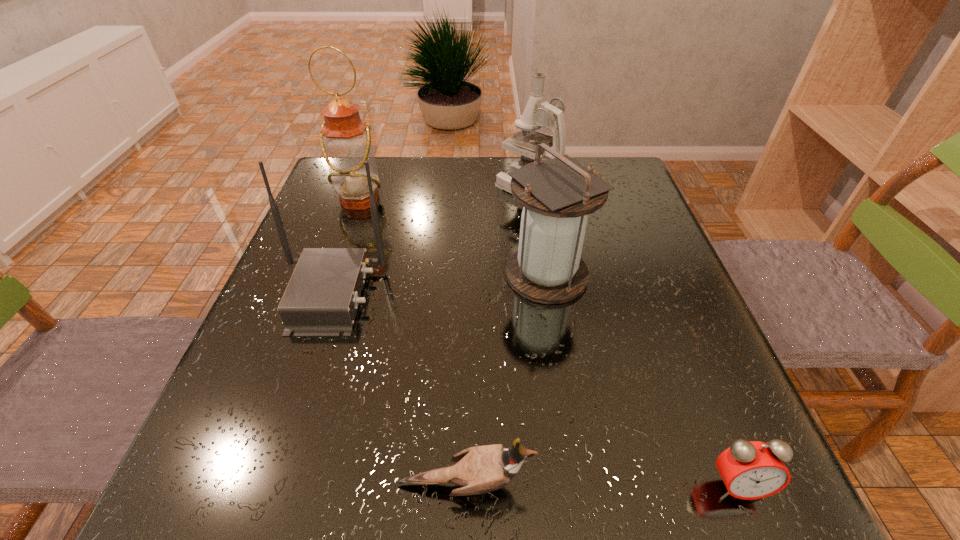
Identify the location of object at the near right corner. The image size is (960, 540). pos(750,470).

The width and height of the screenshot is (960, 540). In order to click on vacant region at the far edge of the desktop in this screenshot , I will do `click(458, 170)`.

You are a GUI agent. You are given a task and a screenshot of the screen. Output one action in this format:
    pyautogui.click(x=<x>, y=<y>)
    Task: Click on the free space at the near edge of the desktop
    The image size is (960, 540).
    Given the screenshot: What is the action you would take?
    pyautogui.click(x=596, y=514)

At what (x,y) coordinates should I click in order to perform the action: click on free spot at the left edge of the desktop. Please return your answer as a coordinate pair (x, y). Looking at the image, I should click on (254, 375).

In the image, there is a desktop. Find the location of `vacant area at the right edge`. vacant area at the right edge is located at coordinates (630, 242).

The image size is (960, 540). Find the location of `vacant region at the far left corner of the desktop`. vacant region at the far left corner of the desktop is located at coordinates (340, 204).

Where is `vacant space at the far right corner of the desktop`? Image resolution: width=960 pixels, height=540 pixels. vacant space at the far right corner of the desktop is located at coordinates (624, 181).

The width and height of the screenshot is (960, 540). Identify the location of free space between the oil lamp and the alarm clock. (548, 343).

The image size is (960, 540). I want to click on free space that is in between the microscope and the tallest object, so click(444, 194).

This screenshot has height=540, width=960. I want to click on blank region between the lantern and the oil lamp, so click(453, 238).